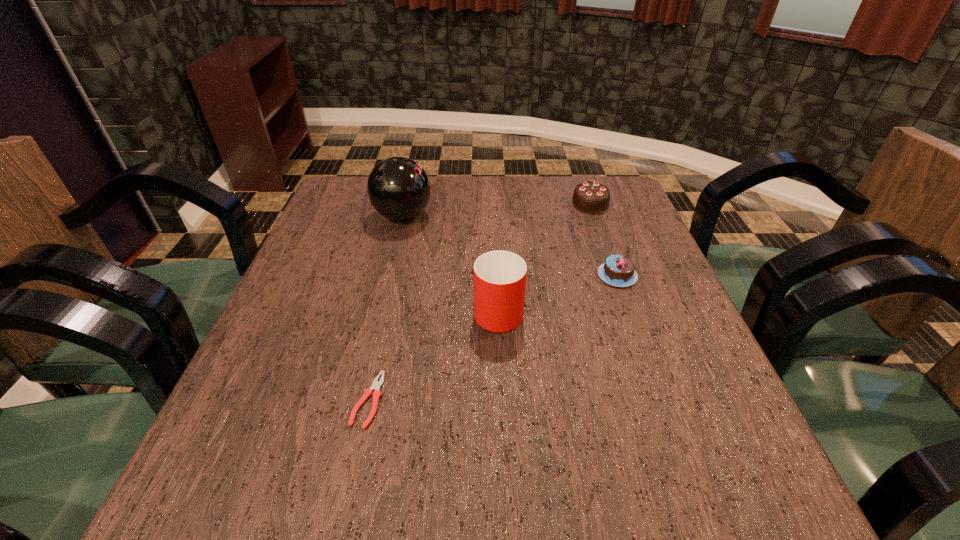
Locate an element on the screen. Image resolution: width=960 pixels, height=540 pixels. bowling ball is located at coordinates (398, 188).

I want to click on cup, so click(x=499, y=276).

This screenshot has width=960, height=540. Find the location of `the fourth shortest object`. the fourth shortest object is located at coordinates (499, 276).

You are a GUI agent. You are given a task and a screenshot of the screen. Output one action in this format:
    pyautogui.click(x=<x>, y=<y>)
    Task: Click on the farther chocolate cake
    The width and height of the screenshot is (960, 540).
    Given the screenshot: What is the action you would take?
    pyautogui.click(x=592, y=197)

At what (x,y) coordinates should I click in order to perform the action: click on the third shortest object. Please return your answer as a coordinate pair (x, y). Looking at the image, I should click on (592, 197).

Find the location of a particular element. Image resolution: width=960 pixels, height=540 pixels. the shorter chocolate cake is located at coordinates (619, 271).

I want to click on the second shortest object, so click(x=619, y=271).

Find the location of a particular element. This screenshot has width=960, height=540. pliers is located at coordinates (376, 385).

Where is `the nearest object`? The height and width of the screenshot is (540, 960). the nearest object is located at coordinates (376, 385).

Where is `vacant space located 0.140m on the surface of the bowling ball near the finger holes`? The height and width of the screenshot is (540, 960). vacant space located 0.140m on the surface of the bowling ball near the finger holes is located at coordinates (485, 215).